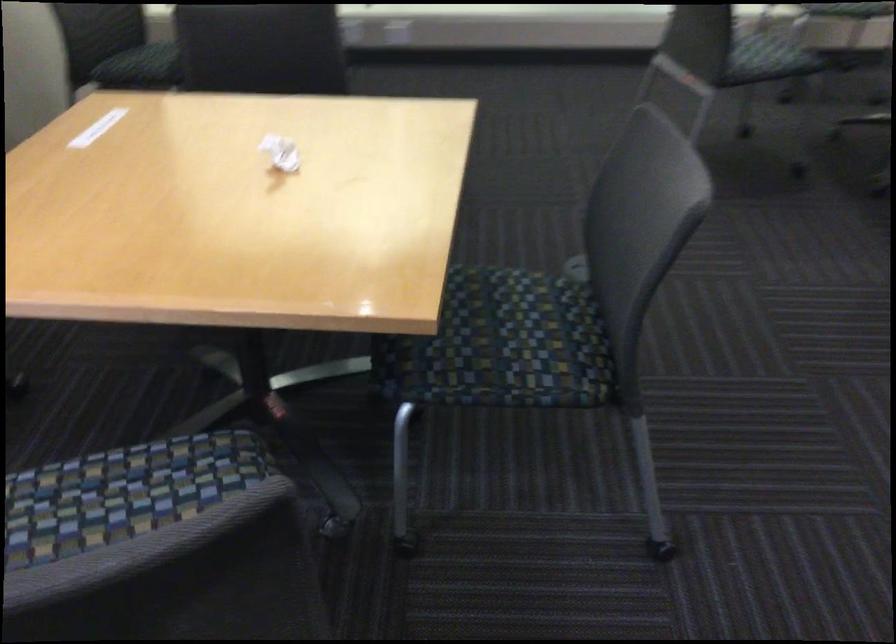
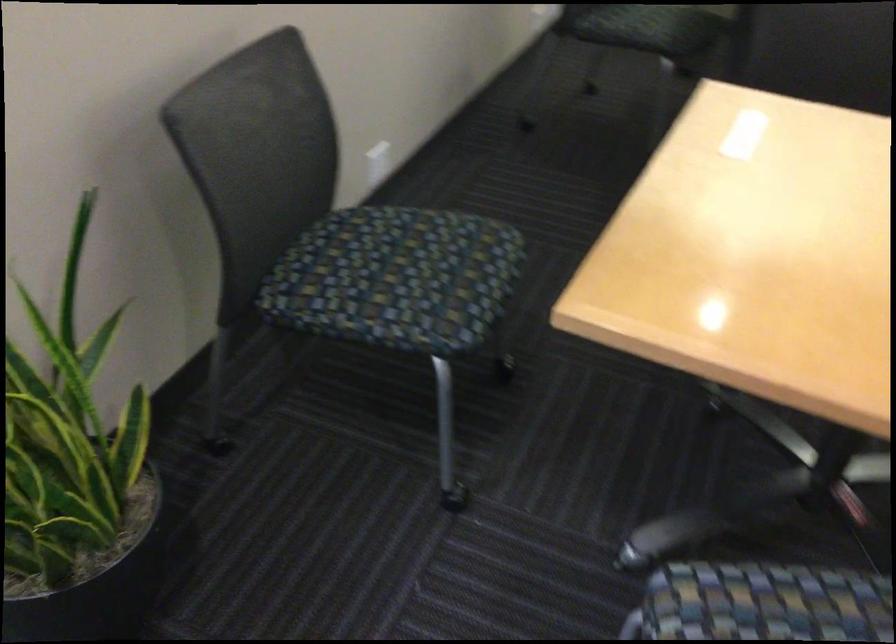
Find the pixel in the second image that matches pixel 171 69 in the first image.

(649, 28)